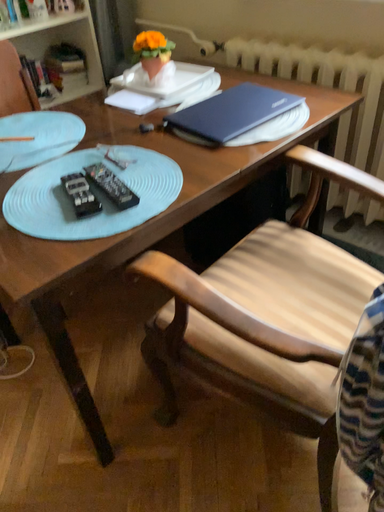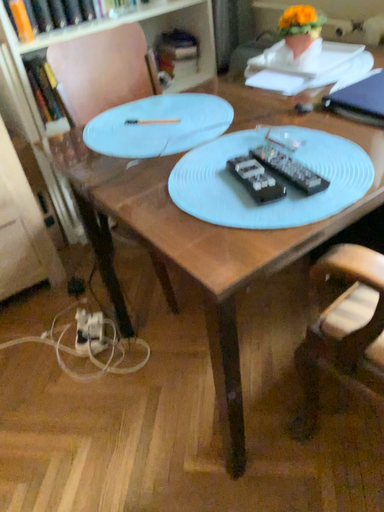
Question: Which way did the camera rotate in the video?

Choices:
 (A) rotated left
 (B) rotated right

Answer: (A)